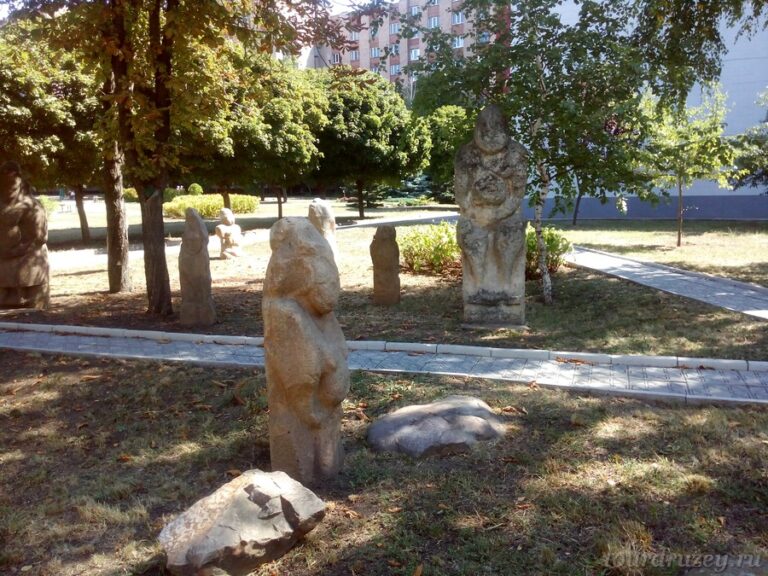
Locate an element on the screen. This screenshot has height=576, width=768. wall is located at coordinates (727, 118).